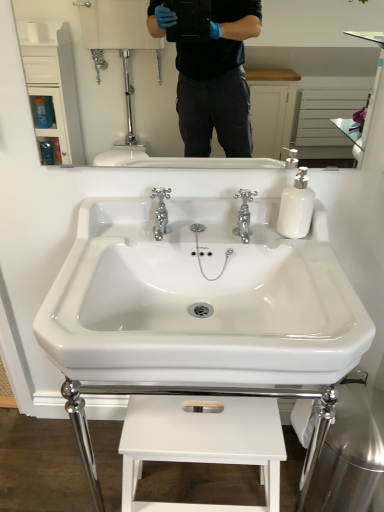
Question: Is white glossy mirror at upper center at the back of chrome metallic faucet at center, acting as the 1th tap starting from the right?

Choices:
 (A) no
 (B) yes

Answer: (A)

Question: Can you confirm if chrome metallic faucet at center, the 2th tap from the left, is smaller than white glossy mirror at upper center?

Choices:
 (A) yes
 (B) no

Answer: (A)

Question: From a real-world perspective, is chrome metallic faucet at center, acting as the 1th tap starting from the right, on white glossy mirror at upper center?

Choices:
 (A) no
 (B) yes

Answer: (A)

Question: Is chrome metallic faucet at center, acting as the 1th tap starting from the right, wider than white glossy mirror at upper center?

Choices:
 (A) yes
 (B) no

Answer: (A)

Question: Would you say chrome metallic faucet at center, acting as the 1th tap starting from the right, contains white glossy mirror at upper center?

Choices:
 (A) yes
 (B) no

Answer: (B)

Question: Considering the relative positions of white glossy sink at center and white matte stool at lower center in the image provided, is white glossy sink at center to the left or to the right of white matte stool at lower center?

Choices:
 (A) right
 (B) left

Answer: (B)

Question: From the image's perspective, relative to white matte stool at lower center, is white glossy sink at center above or below?

Choices:
 (A) above
 (B) below

Answer: (A)

Question: Looking at the image, does white glossy sink at center seem bigger or smaller compared to white matte stool at lower center?

Choices:
 (A) small
 (B) big

Answer: (A)

Question: In terms of width, does white glossy sink at center look wider or thinner when compared to white matte stool at lower center?

Choices:
 (A) thin
 (B) wide

Answer: (B)

Question: In the image, is chrome metallic faucet at center, arranged as the first tap when viewed from the left, positioned in front of or behind white matte stool at lower center?

Choices:
 (A) front
 (B) behind

Answer: (B)

Question: Considering the positions of chrome metallic faucet at center, the second tap when ordered from right to left, and white matte stool at lower center in the image, is chrome metallic faucet at center, the second tap when ordered from right to left, taller or shorter than white matte stool at lower center?

Choices:
 (A) short
 (B) tall

Answer: (A)

Question: Considering the positions of chrome metallic faucet at center, arranged as the first tap when viewed from the left, and white matte stool at lower center in the image, is chrome metallic faucet at center, arranged as the first tap when viewed from the left, wider or thinner than white matte stool at lower center?

Choices:
 (A) wide
 (B) thin

Answer: (B)

Question: Is chrome metallic faucet at center, the second tap when ordered from right to left, inside or outside of white matte stool at lower center?

Choices:
 (A) inside
 (B) outside

Answer: (B)

Question: Considering the positions of point (203, 459) and point (246, 226), is point (203, 459) closer or farther from the camera than point (246, 226)?

Choices:
 (A) closer
 (B) farther

Answer: (A)

Question: Is white matte stool at lower center bigger or smaller than chrome metallic faucet at center, acting as the 1th tap starting from the right?

Choices:
 (A) small
 (B) big

Answer: (B)